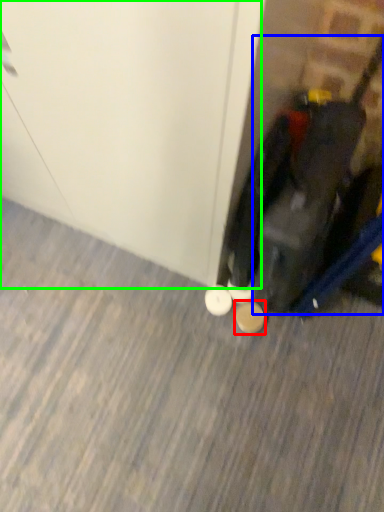
Question: Which object is positioned farthest from footwear (highlighted by a red box)? Select from luggage (highlighted by a blue box) and door (highlighted by a green box).

Choices:
 (A) luggage
 (B) door

Answer: (B)